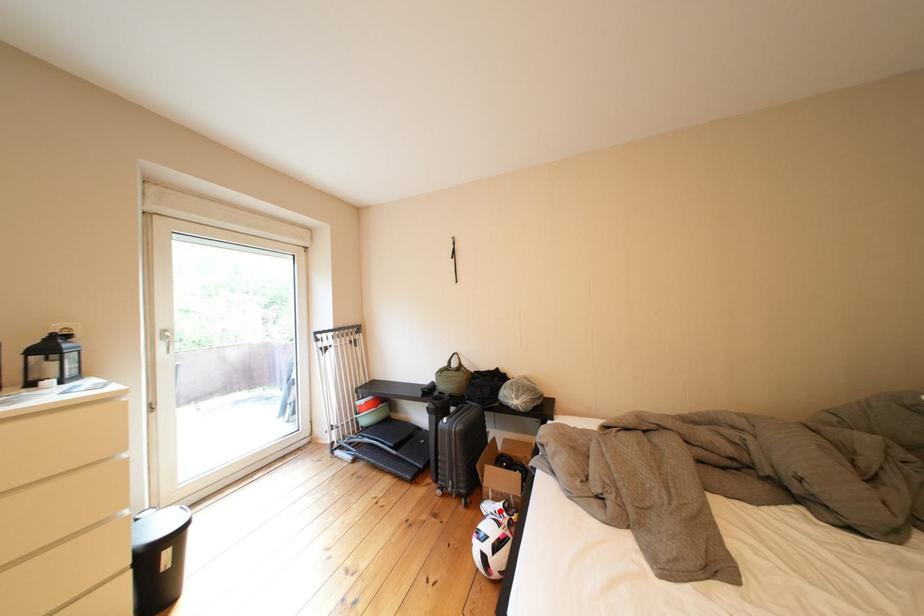
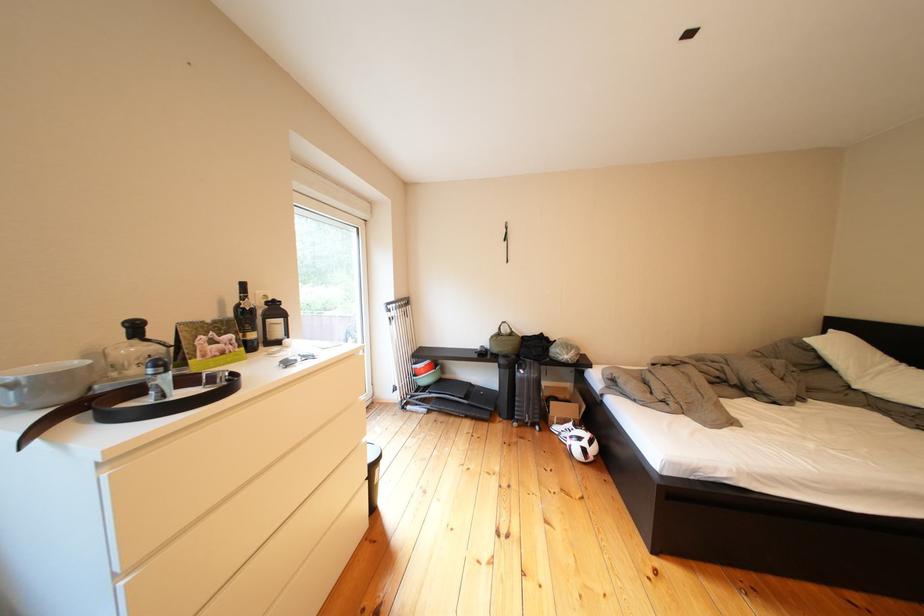
The point at the highlighted location is marked in the first image. Where is the corresponding point in the second image?

(570, 432)